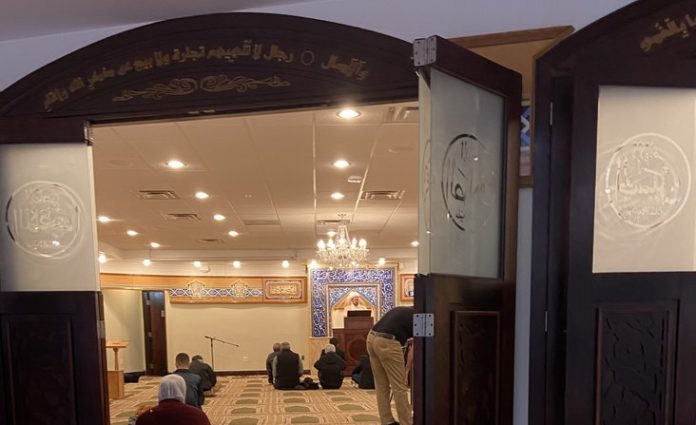
The height and width of the screenshot is (425, 696). Find the location of `ceiling`. ceiling is located at coordinates (273, 144).